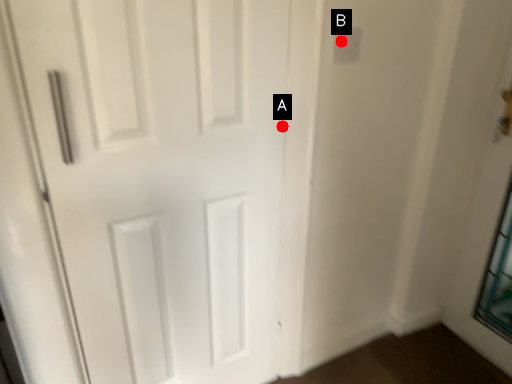
Question: Two points are circled on the image, labeled by A and B beside each circle. Which point is closer to the camera taking this photo?

Choices:
 (A) A is closer
 (B) B is closer

Answer: (B)